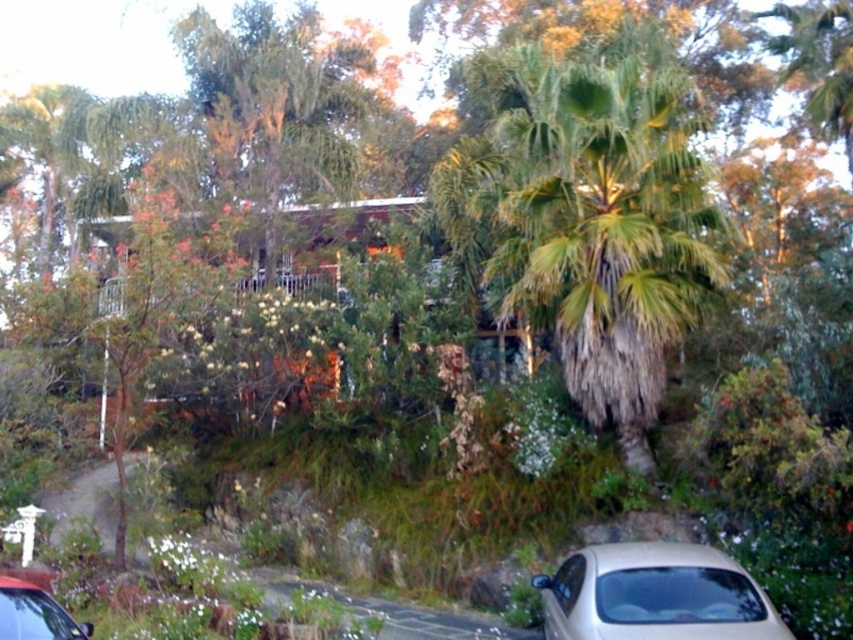
Question: In this image, where is beige matte car at lower right located relative to metallic silver car at lower left?

Choices:
 (A) below
 (B) above

Answer: (A)

Question: Is beige matte car at lower right behind metallic silver car at lower left?

Choices:
 (A) no
 (B) yes

Answer: (B)

Question: Is the position of beige matte car at lower right less distant than that of metallic silver car at lower left?

Choices:
 (A) no
 (B) yes

Answer: (A)

Question: Which object appears closest to the camera in this image?

Choices:
 (A) beige matte car at lower right
 (B) metallic silver car at lower left

Answer: (B)